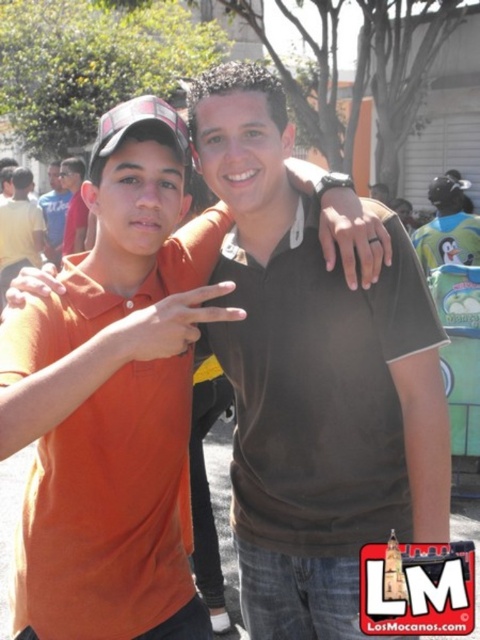
You are a photographer trying to capture a clear shot of both the orange cotton shirt at left and the matte black shirt at center. Since you want both subjects to appear equally tall in the photo, which adjustment should you make based on their current positions?

The orange cotton shirt at left is taller than the matte black shirt at center. To make them appear equal in height in the photo, you should position the camera lower to reduce the apparent height of the taller subject or raise the camera angle slightly to shorten the height difference between them.

You are a photographer standing at the event. You want to take a closeup photo of the orange cotton shirt at center. What is the minimum distance you need to move forward to ensure the shirt fills the frame?

The orange cotton shirt at center is currently 1.78 meters away from the camera. To take a closeup, you need to move forward until the shirt is within the ideal focus range, typically around 1 meter. Therefore, move approximately 0.78 meters closer.

You are a photographer trying to capture a group photo of the orange cotton shirt at center and the matte black shirt at center. Since you want both subjects to appear equally tall in the photo, which subject should you position closer to the camera?

The orange cotton shirt at center is not as tall as matte black shirt at center, so to make them appear equally tall in the photo, position the orange cotton shirt at center closer to the camera than the matte black shirt at center.